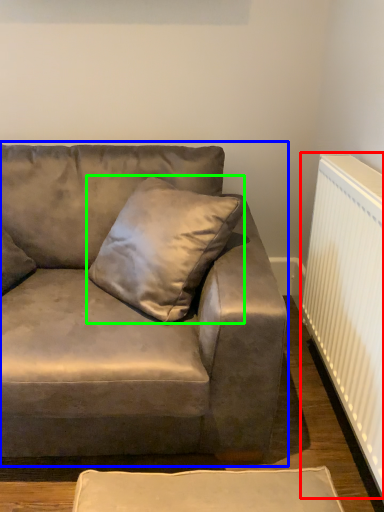
Question: Based on their relative distances, which object is nearer to radiator (highlighted by a red box)? Choose from studio couch (highlighted by a blue box) and pillow (highlighted by a green box).

Choices:
 (A) studio couch
 (B) pillow

Answer: (A)